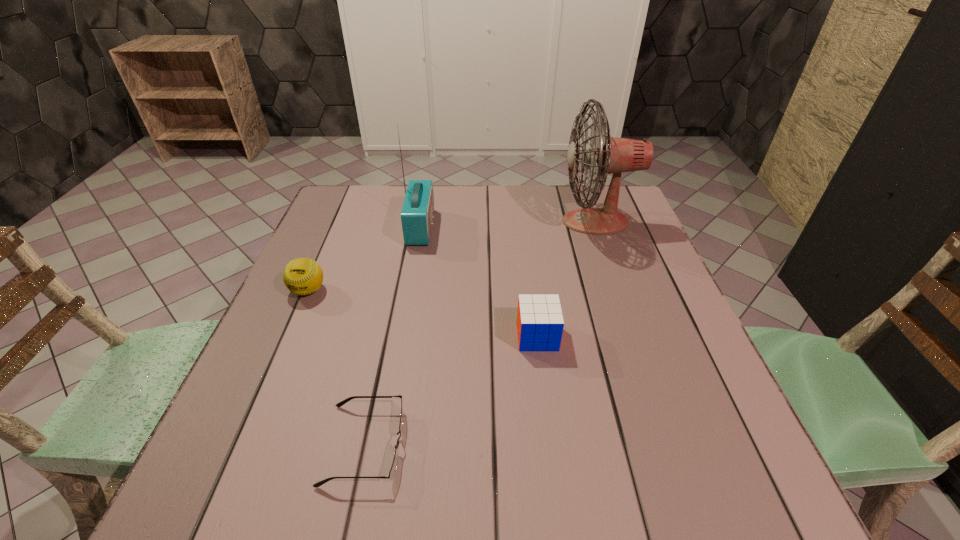
Identify the location of blank space that satisfies the following two spatial constraints: 1. on the front panel of the second nearest object; 2. on the right side of the second tallest object. click(401, 336).

This screenshot has height=540, width=960. I want to click on vacant position in the image that satisfies the following two spatial constraints: 1. on the front panel of the second object from right to left; 2. on the left side of the radio receiver, so click(401, 336).

This screenshot has height=540, width=960. I want to click on vacant space that satisfies the following two spatial constraints: 1. in front of the rightmost object to direct airflow; 2. on the logo side of the softball, so click(x=619, y=291).

I want to click on vacant region that satisfies the following two spatial constraints: 1. on the back side of the cube; 2. on the front panel of the second tallest object, so click(523, 227).